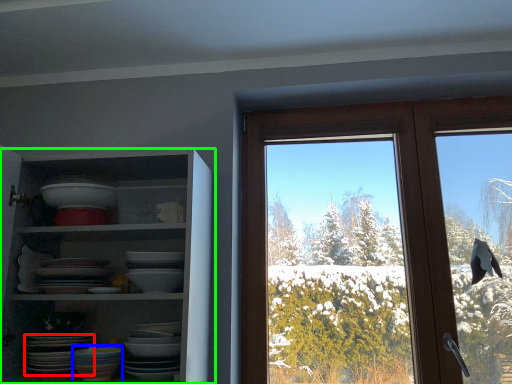
Question: Which object is the farthest from platter (highlighted by a red box)? Choose among these: tableware (highlighted by a blue box) or shelf (highlighted by a green box).

Choices:
 (A) tableware
 (B) shelf

Answer: (B)